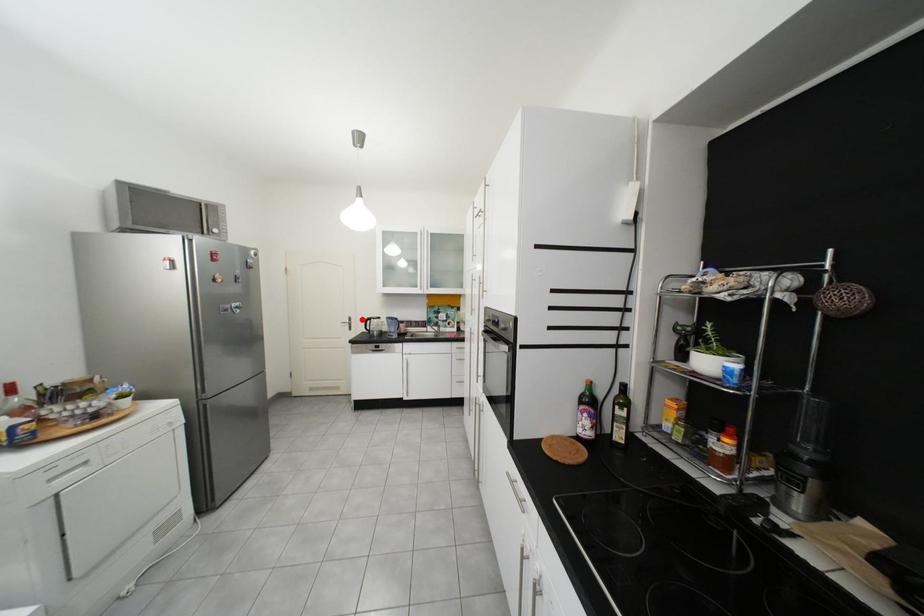
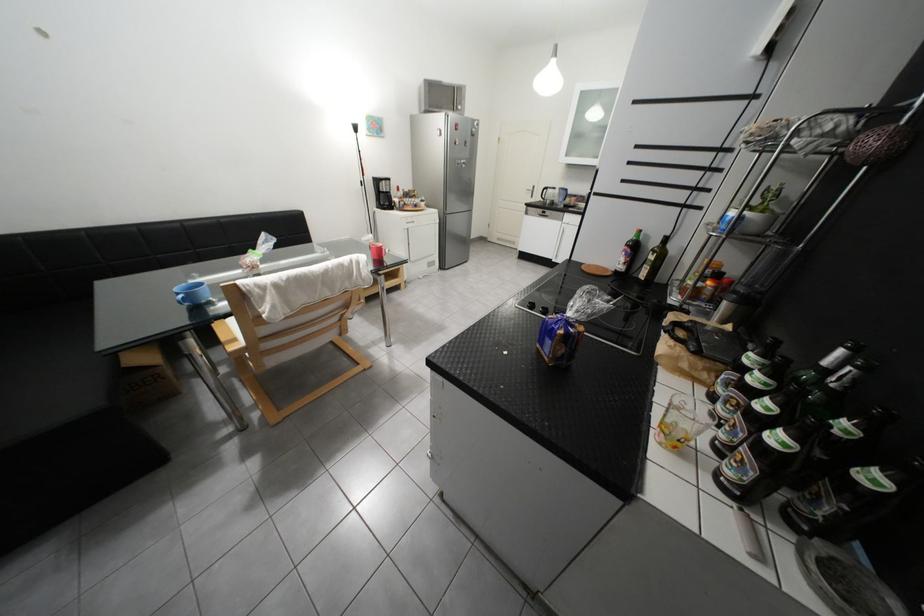
The point at the highlighted location is marked in the first image. Where is the corresponding point in the second image?

(545, 188)